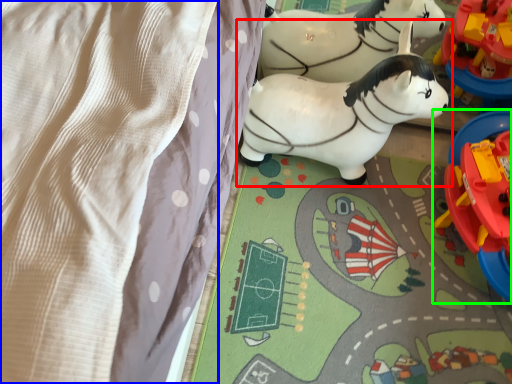
Question: Which object is positioned closest to toy (highlighted by a red box)? Select from blanket (highlighted by a blue box) and toy (highlighted by a green box).

Choices:
 (A) blanket
 (B) toy

Answer: (B)